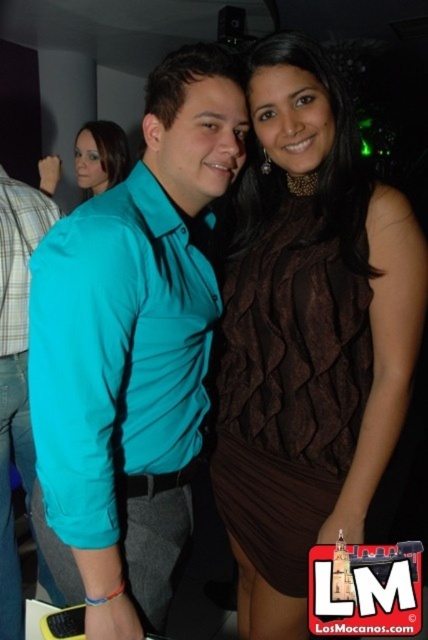
Identify the location of teal shirt at center. Image resolution: width=428 pixels, height=640 pixels. (131, 349).

Can you confirm if teal shirt at center is positioned to the left of matte teal shirt at center?

Incorrect, teal shirt at center is not on the left side of matte teal shirt at center.

Who is more distant from viewer, (146, 138) or (38, 218)?

Point (38, 218)

The width and height of the screenshot is (428, 640). What are the coordinates of `teal shirt at center` in the screenshot? It's located at (131, 349).

Is teal shirt at center below matte teal blouse at upper left?

Indeed, teal shirt at center is positioned under matte teal blouse at upper left.

Is point (175, 404) farther from viewer compared to point (119, 168)?

No, it is in front of (119, 168).

Where is `teal shirt at center`? This screenshot has width=428, height=640. teal shirt at center is located at coordinates (131, 349).

Between teal shirt at center and brown textured dress at center, which one is positioned lower?

Positioned lower is brown textured dress at center.

In the scene shown: Which is above, teal shirt at center or brown textured dress at center?

teal shirt at center

Is point (187, 220) behind point (303, 557)?

No, (187, 220) is closer to viewer.

Where is `teal shirt at center`? teal shirt at center is located at coordinates (131, 349).